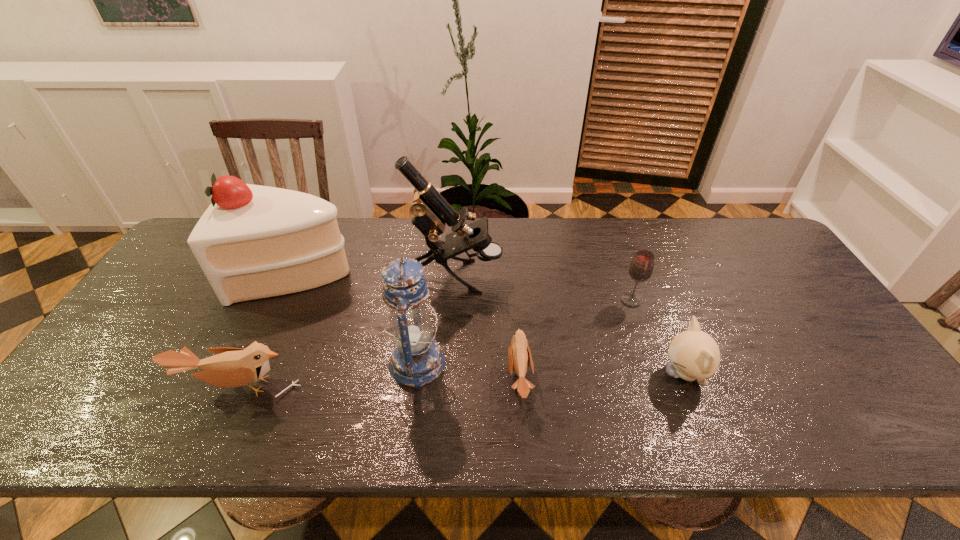
This screenshot has width=960, height=540. I want to click on vacant space situated through the eyepiece of the microscope, so point(622,276).

At what (x,y) coordinates should I click in order to perform the action: click on vacant space located on the front of the glass drink container. Please return your answer as a coordinate pair (x, y). Looking at the image, I should click on click(639, 325).

The width and height of the screenshot is (960, 540). Find the location of `vacant area located on the front-facing side of the lantern`. vacant area located on the front-facing side of the lantern is located at coordinates (510, 363).

In order to click on blank area located on the face of the kitten in this screenshot , I will do `click(550, 374)`.

You are a GUI agent. You are given a task and a screenshot of the screen. Output one action in this format:
    pyautogui.click(x=<x>, y=<y>)
    Task: Click on the free space located on the face of the kitten
    
    Given the screenshot: What is the action you would take?
    pyautogui.click(x=517, y=374)

Image resolution: width=960 pixels, height=540 pixels. Identify the location of free spot located on the face of the kitten. (530, 374).

Locate an element on the screen. The width and height of the screenshot is (960, 540). cake present at the far edge is located at coordinates (x=252, y=242).

Identify the location of microscope present at the far edge. The image size is (960, 540). (431, 211).

Find the location of `lantern at the near edge`. lantern at the near edge is located at coordinates (416, 360).

This screenshot has height=540, width=960. In order to click on kitten that is at the near edge in this screenshot , I will do `click(694, 354)`.